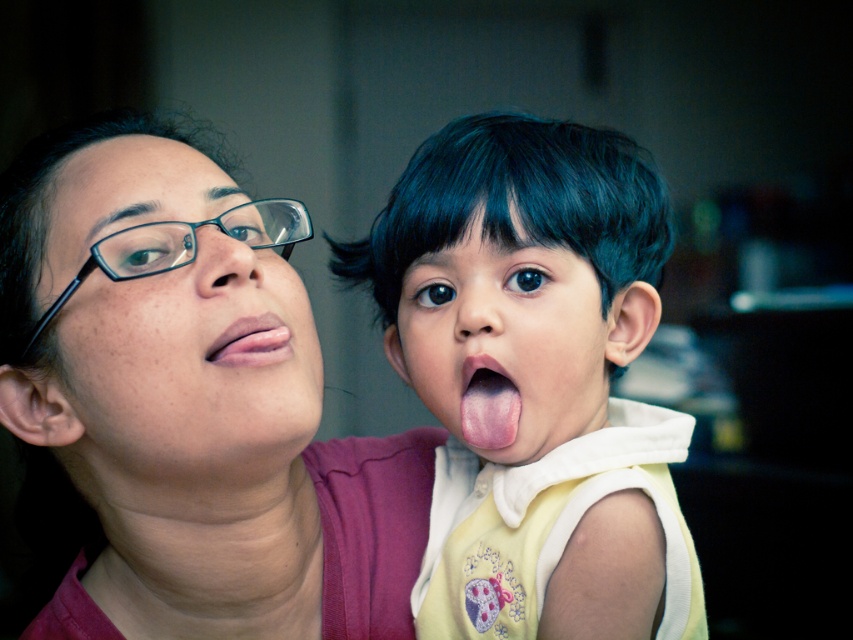
Does point (477, 141) come in front of point (166, 244)?

No, it is behind (166, 244).

Does point (554, 317) lie in front of point (160, 228)?

No, (554, 317) is behind (160, 228).

This screenshot has width=853, height=640. What are the coordinates of `smooth yellow shirt at center` in the screenshot? It's located at (537, 378).

Is smooth yellow shirt at center further to camera compared to smooth skin face at center?

No, smooth yellow shirt at center is closer to the viewer.

Is point (650, 236) in front of point (489, 344)?

No, (650, 236) is further to viewer.

Between point (474, 598) and point (602, 346), which one is positioned behind?

Positioned behind is point (474, 598).

The width and height of the screenshot is (853, 640). I want to click on smooth yellow shirt at center, so click(x=537, y=378).

Does matte pink shirt at upper left have a greater height compared to black plastic glasses at upper left?

Yes, matte pink shirt at upper left is taller than black plastic glasses at upper left.

Is point (398, 580) positioned after point (53, 310)?

Yes, point (398, 580) is behind point (53, 310).

Identify the location of matte pink shirt at upper left. Image resolution: width=853 pixels, height=640 pixels. (184, 408).